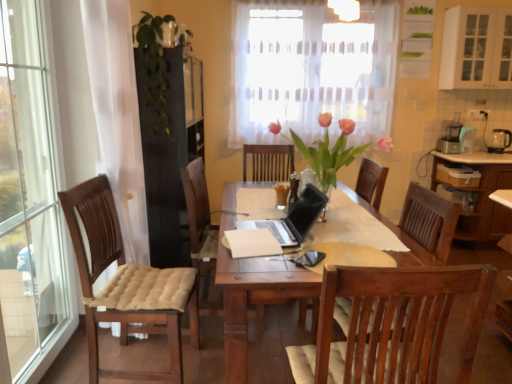
Question: Is pink glass vase at center, positioned as the 1th floral arrangement in front-to-back order, not within wooden cabinet at right, the 1th cabinetry when ordered from bottom to top?

Choices:
 (A) no
 (B) yes

Answer: (B)

Question: From a real-world perspective, is pink glass vase at center, which is counted as the 1th floral arrangement, starting from the bottom, on top of wooden cabinet at right, the 1th cabinetry when ordered from bottom to top?

Choices:
 (A) yes
 (B) no

Answer: (A)

Question: Is pink glass vase at center, the 2th floral arrangement in the back-to-front sequence, shorter than wooden cabinet at right, the 1th cabinetry when ordered from bottom to top?

Choices:
 (A) yes
 (B) no

Answer: (A)

Question: Can you confirm if pink glass vase at center, which is counted as the 1th floral arrangement, starting from the bottom, is positioned to the right of wooden cabinet at right, the 1th cabinetry when ordered from bottom to top?

Choices:
 (A) no
 (B) yes

Answer: (A)

Question: From a real-world perspective, is pink glass vase at center, positioned as the 1th floral arrangement in front-to-back order, positioned under wooden cabinet at right, positioned as the second cabinetry in top-to-bottom order, based on gravity?

Choices:
 (A) no
 (B) yes

Answer: (A)

Question: Based on their sizes in the image, would you say green leafy plant at upper left, the 2th floral arrangement in the front-to-back sequence, is bigger or smaller than white matte cabinet at upper right, which ranks as the first cabinetry in top-to-bottom order?

Choices:
 (A) big
 (B) small

Answer: (B)

Question: Relative to white matte cabinet at upper right, which ranks as the first cabinetry in top-to-bottom order, is green leafy plant at upper left, the second floral arrangement when ordered from right to left, in front or behind?

Choices:
 (A) behind
 (B) front

Answer: (B)

Question: Is green leafy plant at upper left, which appears as the first floral arrangement when viewed from the top, taller or shorter than white matte cabinet at upper right, positioned as the second cabinetry in bottom-to-top order?

Choices:
 (A) short
 (B) tall

Answer: (B)

Question: Is green leafy plant at upper left, arranged as the 1th floral arrangement when viewed from the left, inside the boundaries of white matte cabinet at upper right, which ranks as the first cabinetry in top-to-bottom order, or outside?

Choices:
 (A) outside
 (B) inside

Answer: (A)

Question: Is point (497, 135) positioned closer to the camera than point (458, 38)?

Choices:
 (A) farther
 (B) closer

Answer: (A)

Question: From their relative heights in the image, would you say black glass kettle at right is taller or shorter than white matte cabinet at upper right, positioned as the second cabinetry in bottom-to-top order?

Choices:
 (A) tall
 (B) short

Answer: (B)

Question: Considering the positions of black glass kettle at right and white matte cabinet at upper right, positioned as the second cabinetry in bottom-to-top order, in the image, is black glass kettle at right bigger or smaller than white matte cabinet at upper right, positioned as the second cabinetry in bottom-to-top order,?

Choices:
 (A) small
 (B) big

Answer: (A)

Question: From a real-world perspective, is black glass kettle at right above or below white matte cabinet at upper right, which ranks as the first cabinetry in top-to-bottom order?

Choices:
 (A) above
 (B) below

Answer: (B)

Question: In the image, is wooden cabinet at right, positioned as the second cabinetry in top-to-bottom order, positioned in front of or behind translucent fabric curtain at upper center?

Choices:
 (A) front
 (B) behind

Answer: (A)

Question: Considering the positions of wooden cabinet at right, positioned as the second cabinetry in top-to-bottom order, and translucent fabric curtain at upper center in the image, is wooden cabinet at right, positioned as the second cabinetry in top-to-bottom order, bigger or smaller than translucent fabric curtain at upper center?

Choices:
 (A) big
 (B) small

Answer: (A)